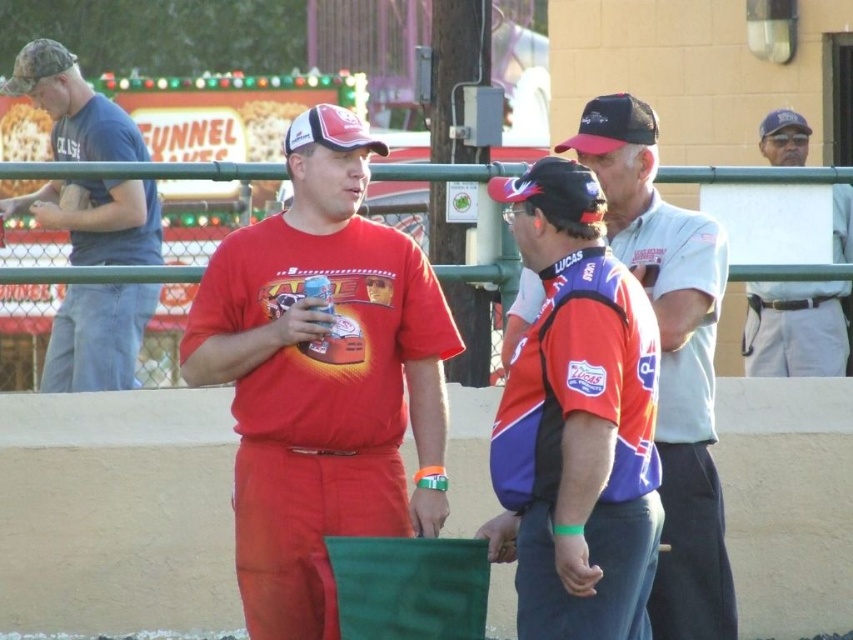
You are at a carnival and see two items in the foreground. The red polyester jersey at center and the black mesh baseball cap at upper center. Which one is bigger?

The red polyester jersey at center is larger in size compared to the black mesh baseball cap at upper center.